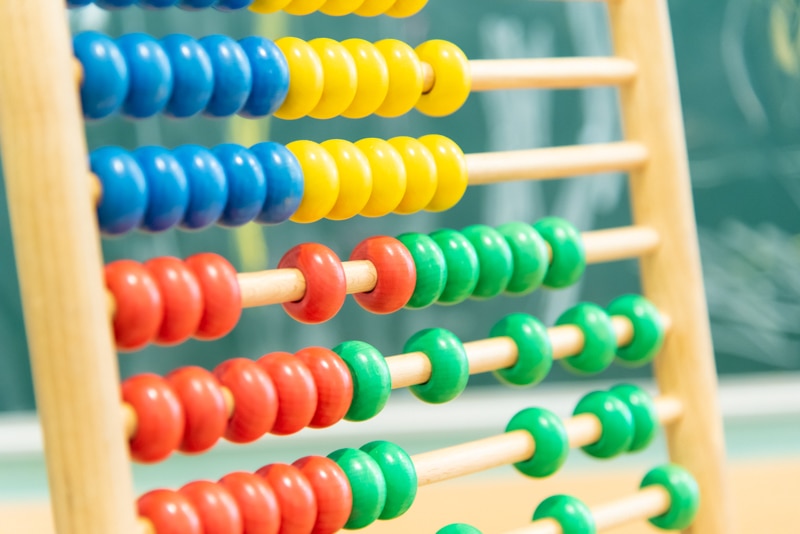
The height and width of the screenshot is (534, 800). What are the coordinates of `wood dowel` in the screenshot? It's located at click(x=613, y=512), click(x=585, y=431), click(x=565, y=339), click(x=620, y=246), click(x=550, y=164), click(x=565, y=78).